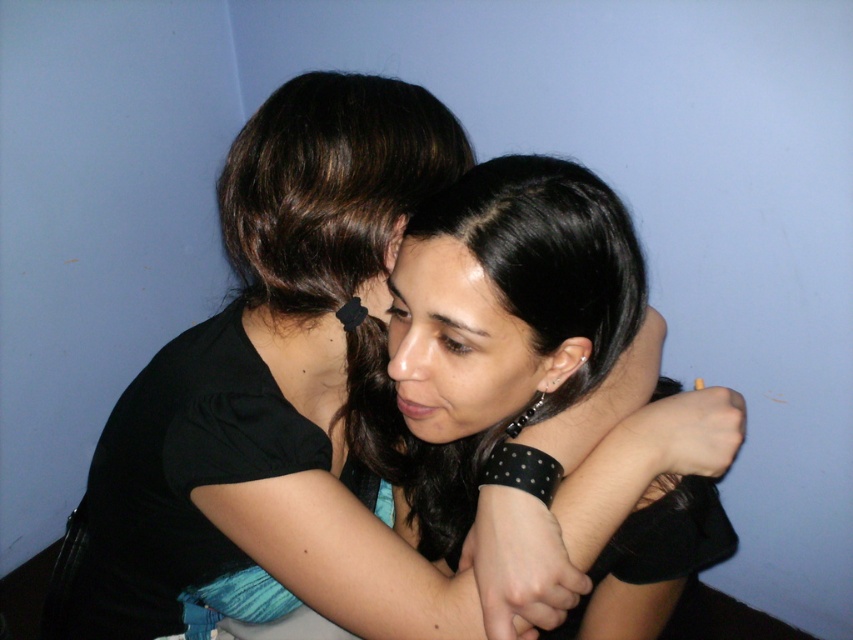
Question: Considering the relative positions of black dotted bracelet at center and smooth skin forehead at center in the image provided, where is black dotted bracelet at center located with respect to smooth skin forehead at center?

Choices:
 (A) above
 (B) below

Answer: (B)

Question: Based on their relative distances, which object is nearer to the black matte shirt at center?

Choices:
 (A) black dotted bracelet at center
 (B) smooth skin forehead at center

Answer: (A)

Question: Does black matte shirt at center have a larger size compared to black dotted bracelet at center?

Choices:
 (A) yes
 (B) no

Answer: (A)

Question: Which object appears closest to the camera in this image?

Choices:
 (A) black matte shirt at center
 (B) black dotted bracelet at center
 (C) smooth skin forehead at center

Answer: (B)

Question: Considering the real-world distances, which object is farthest from the black dotted bracelet at center?

Choices:
 (A) smooth skin forehead at center
 (B) black matte shirt at center

Answer: (A)

Question: Is black matte shirt at center to the left of smooth skin forehead at center from the viewer's perspective?

Choices:
 (A) no
 (B) yes

Answer: (B)